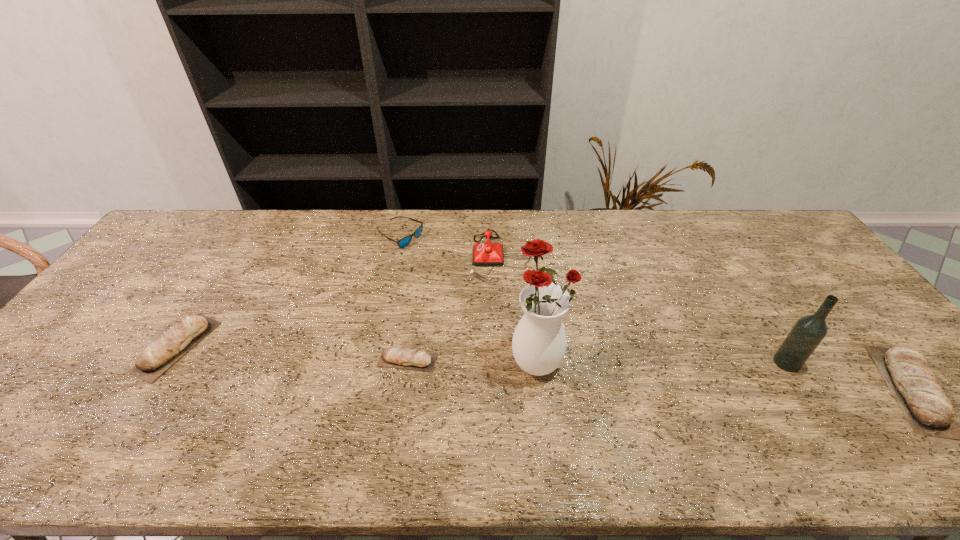
To ensure equal spacing by inserting another pita_(bread) among them, please point out a vacant spot for this new pita_(bread). Please provide its 2D coordinates. Your answer should be formatted as a tuple, i.e. [(x, y)], where the tuple contains the x and y coordinates of a point satisfying the conditions above.

[(652, 374)]